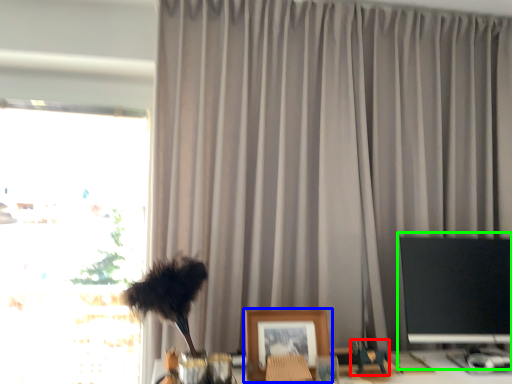
Question: Considering the real-world distances, which object is closest to toy (highlighted by a red box)? picture frame (highlighted by a blue box) or computer monitor (highlighted by a green box).

Choices:
 (A) picture frame
 (B) computer monitor

Answer: (A)